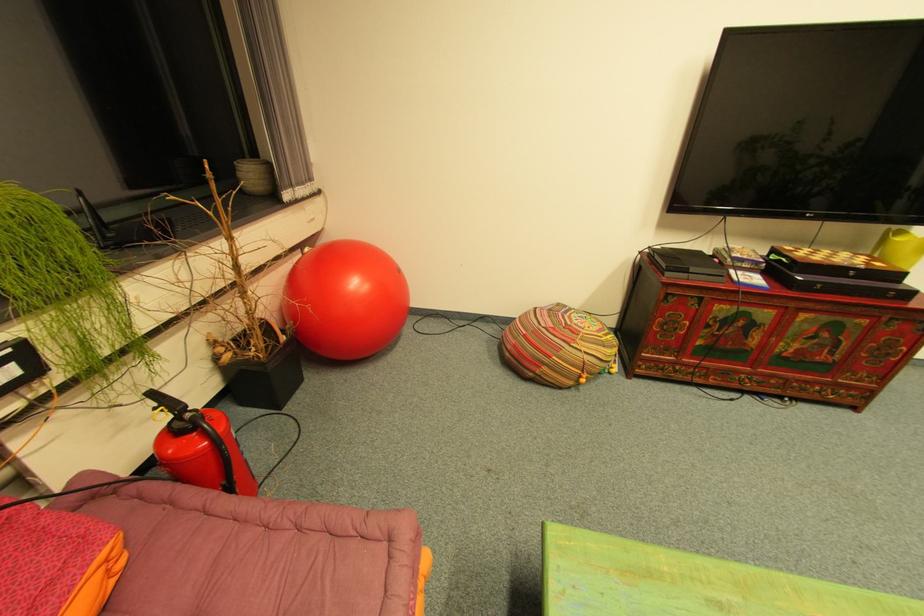
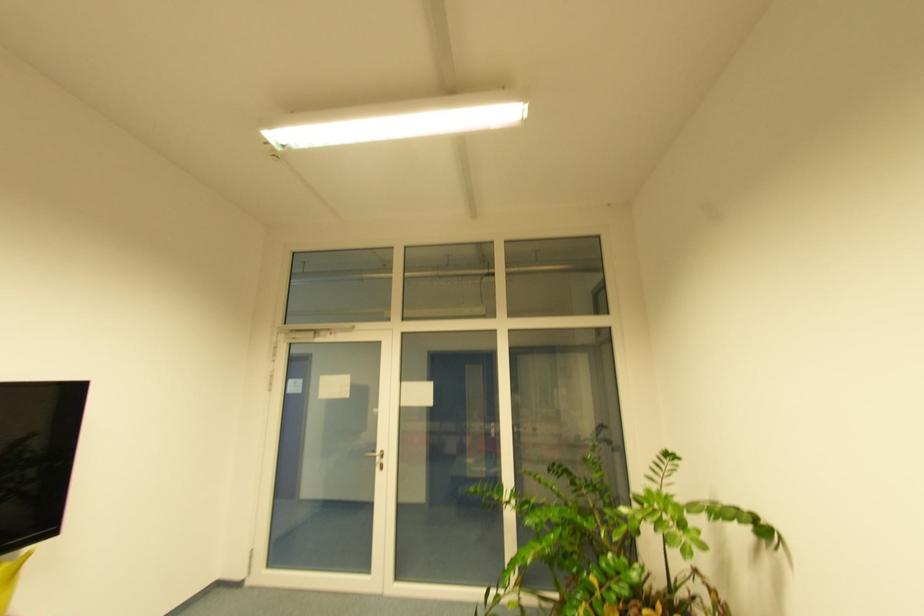
Question: The first image is from the beginning of the video and the second image is from the end. How did the camera likely rotate when shooting the video?

Choices:
 (A) Left
 (B) Right
 (C) Up
 (D) Down

Answer: (B)